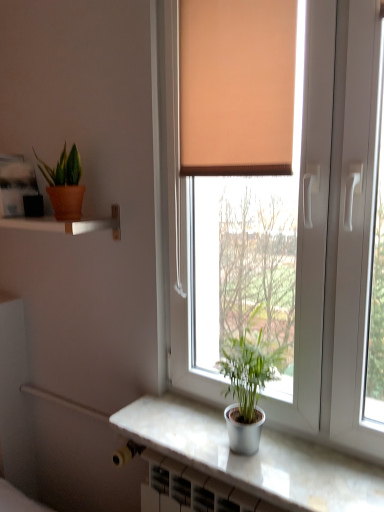
Image resolution: width=384 pixels, height=512 pixels. In order to click on free space above white marble counter top at lower center (from a real-world perspective) in this screenshot , I will do `click(251, 446)`.